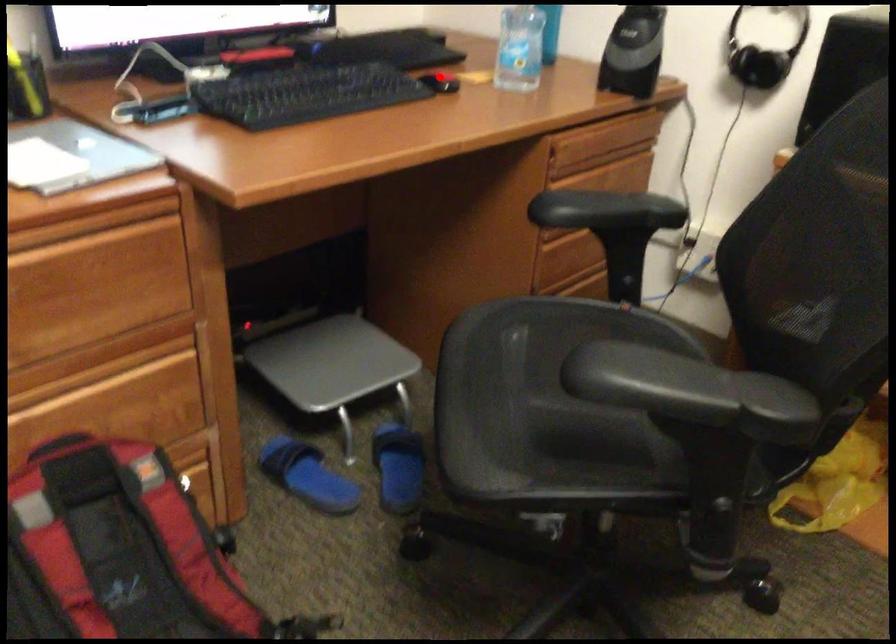
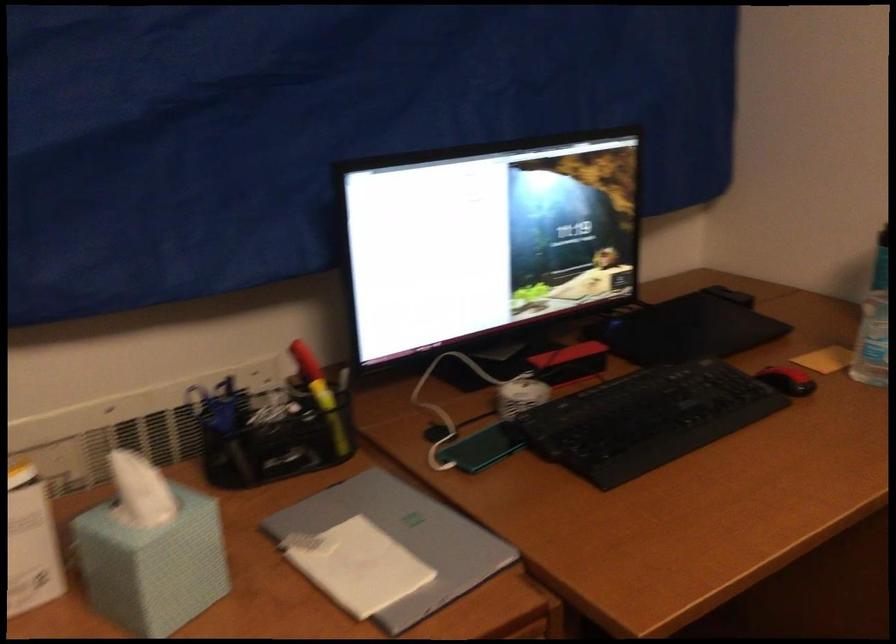
In the second image, find the point that corresponds to the highlighted location in the first image.

(787, 380)